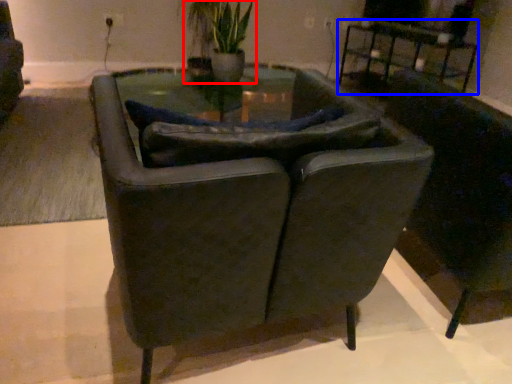
Question: Which object appears closest to the camera in this image, houseplant (highlighted by a red box) or table (highlighted by a blue box)?

Choices:
 (A) houseplant
 (B) table

Answer: (B)